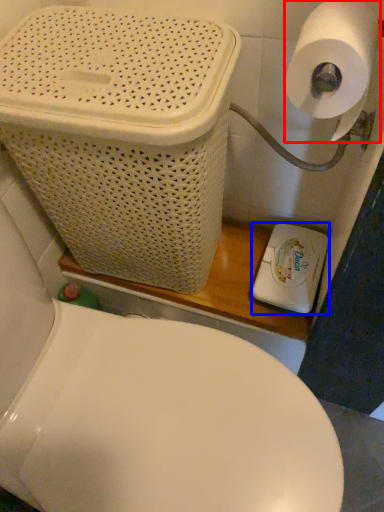
Question: Which of the following is the closest to the observer, toilet paper (highlighted by a red box) or appliance (highlighted by a blue box)?

Choices:
 (A) toilet paper
 (B) appliance

Answer: (A)